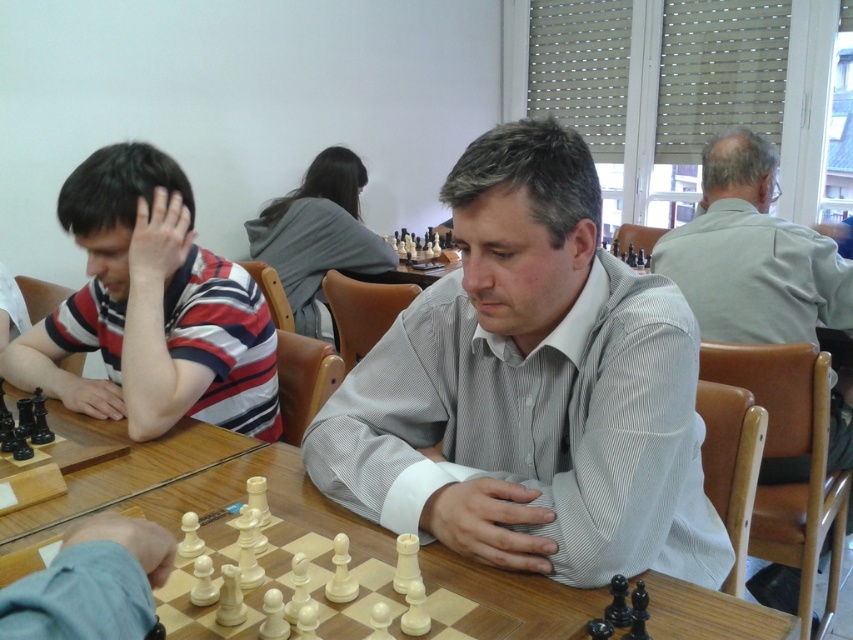
Question: Observing the image, what is the correct spatial positioning of light gray striped shirt at center in reference to striped cotton shirt at left?

Choices:
 (A) left
 (B) right

Answer: (B)

Question: Which object is farther from the camera taking this photo?

Choices:
 (A) wooden at center
 (B) striped cotton shirt at left
 (C) light gray striped shirt at center
 (D) light gray shirt at upper right

Answer: (D)

Question: Estimate the real-world distances between objects in this image. Which object is closer to the light gray striped shirt at center?

Choices:
 (A) wooden at center
 (B) striped cotton shirt at left
 (C) light gray shirt at upper right

Answer: (A)

Question: Is light gray striped shirt at center thinner than light gray shirt at upper right?

Choices:
 (A) no
 (B) yes

Answer: (A)

Question: Which point is farther to the camera?

Choices:
 (A) light gray striped shirt at center
 (B) striped cotton shirt at left

Answer: (B)

Question: Does striped cotton shirt at left have a smaller size compared to light gray shirt at upper right?

Choices:
 (A) no
 (B) yes

Answer: (B)